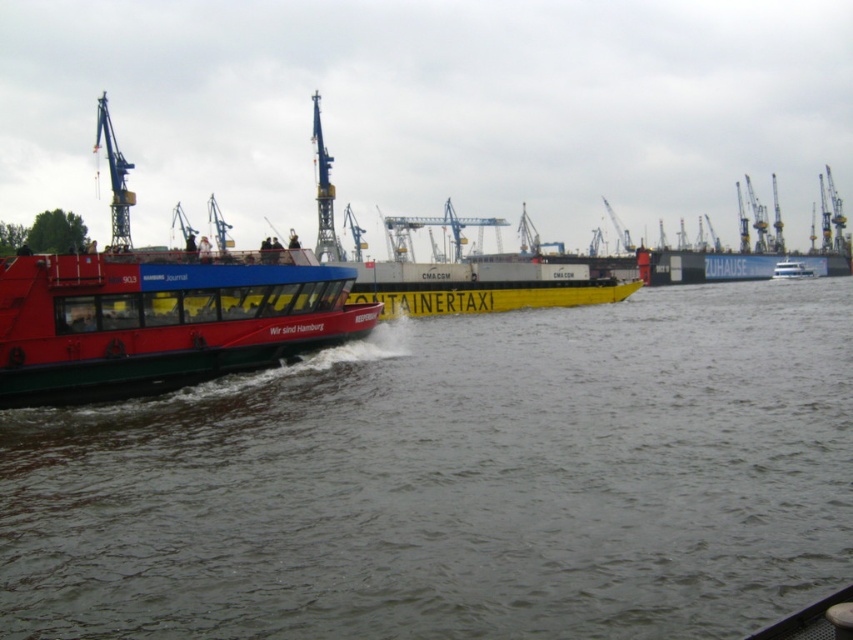
Question: Which object is farther from the camera taking this photo?

Choices:
 (A) yellow matte container taxi at center
 (B) smooth water at center
 (C) matte red ferry at left

Answer: (A)

Question: Is smooth water at center positioned in front of yellow matte container taxi at center?

Choices:
 (A) yes
 (B) no

Answer: (A)

Question: Can you confirm if smooth water at center is positioned to the left of yellow matte container taxi at center?

Choices:
 (A) yes
 (B) no

Answer: (A)

Question: Can you confirm if matte red ferry at left is positioned above yellow matte container taxi at center?

Choices:
 (A) yes
 (B) no

Answer: (B)

Question: Which object appears closest to the camera in this image?

Choices:
 (A) smooth water at center
 (B) matte red ferry at left
 (C) yellow matte container taxi at center

Answer: (A)

Question: Estimate the real-world distances between objects in this image. Which object is closer to the yellow matte container taxi at center?

Choices:
 (A) matte red ferry at left
 (B) smooth water at center

Answer: (B)